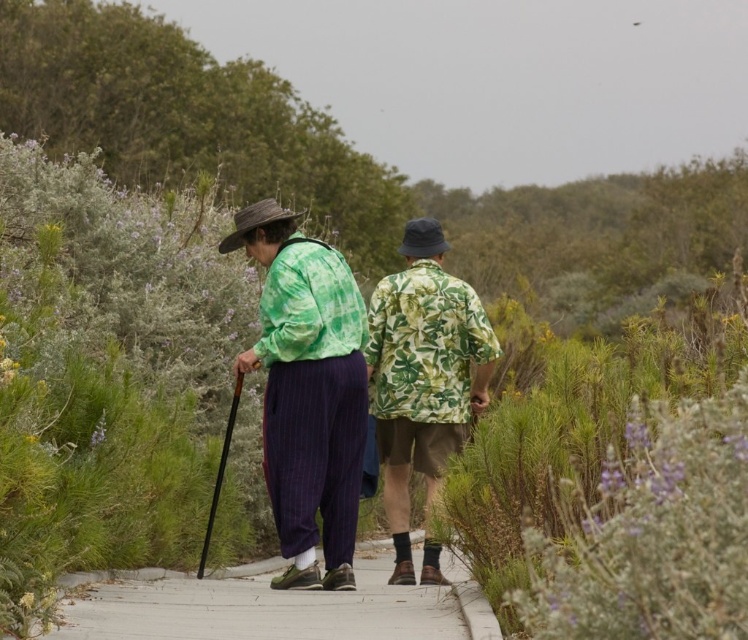
You are a landscape architect designing a new garden path. You observe the scene and notice the concrete at center and the green leafy fabric shirt at center. Which object takes up more space in the image?

The green leafy fabric shirt at center occupies more space than the concrete at center.

You are a photographer trying to capture both the green fabric shirt at center and the green leafy fabric shirt at center in a single frame. Which shirt should you focus on to ensure both are visible without moving the camera?

You should focus on the green leafy fabric shirt at center because it is taller than the green fabric shirt at center, ensuring both can be captured in the frame.